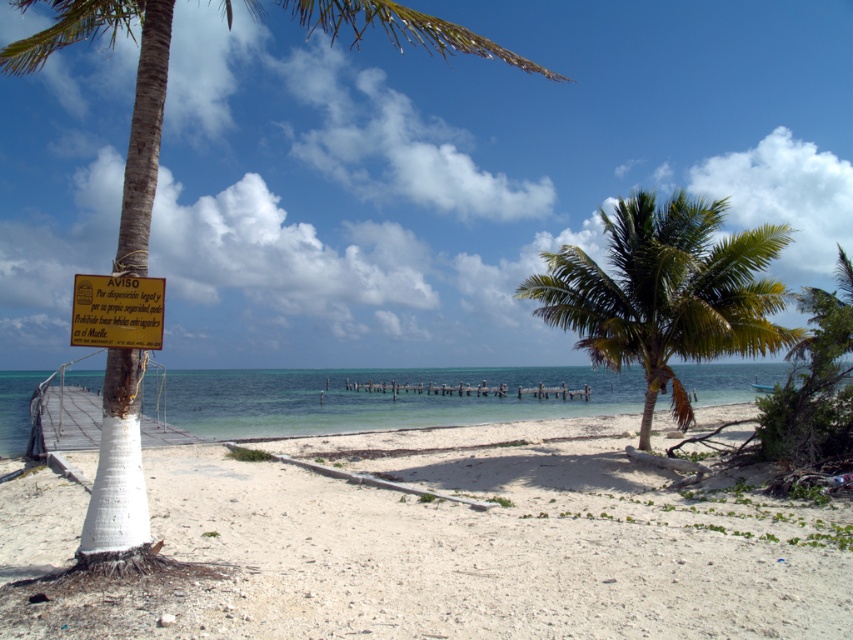
Is white sand beach at lower left thinner than clear blue water at center?

Correct, white sand beach at lower left's width is less than clear blue water at center's.

Who is shorter, white sand beach at lower left or clear blue water at center?

Standing shorter between the two is white sand beach at lower left.

Locate an element on the screen. This screenshot has width=853, height=640. white sand beach at lower left is located at coordinates (439, 545).

Locate an element on the screen. The width and height of the screenshot is (853, 640). white sand beach at lower left is located at coordinates (439, 545).

Who is lower down, green leafy palm tree at center or clear blue water at center?

Positioned lower is clear blue water at center.

Which is in front, point (624, 230) or point (18, 422)?

Point (624, 230) is in front.

This screenshot has height=640, width=853. In order to click on green leafy palm tree at center in this screenshot , I will do `click(666, 292)`.

Which is more to the right, clear blue water at center or matte yellow sign at upper left?

matte yellow sign at upper left

Who is lower down, clear blue water at center or matte yellow sign at upper left?

clear blue water at center is lower down.

Where is `clear blue water at center`? clear blue water at center is located at coordinates (376, 397).